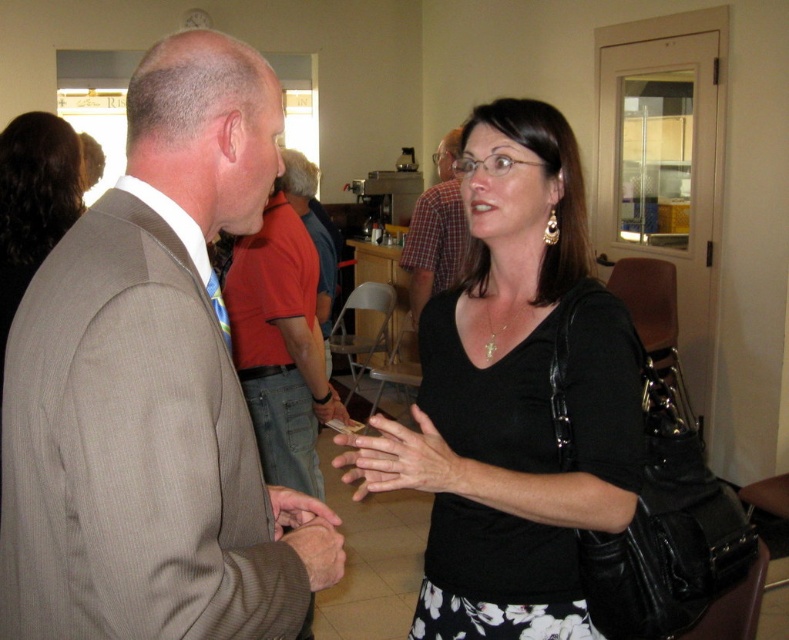
What are the coordinates of the light brown suit at center?

The light brown suit at center is located at coordinates point (152,390).

You are organizing a photo shoot and need to arrange two models wearing the light brown suit at center and the black matte shirt at center. According to the image, which model should stand to the left to maintain the original composition?

The light brown suit at center should stand to the left of the black matte shirt at center to maintain the original composition as per the image.